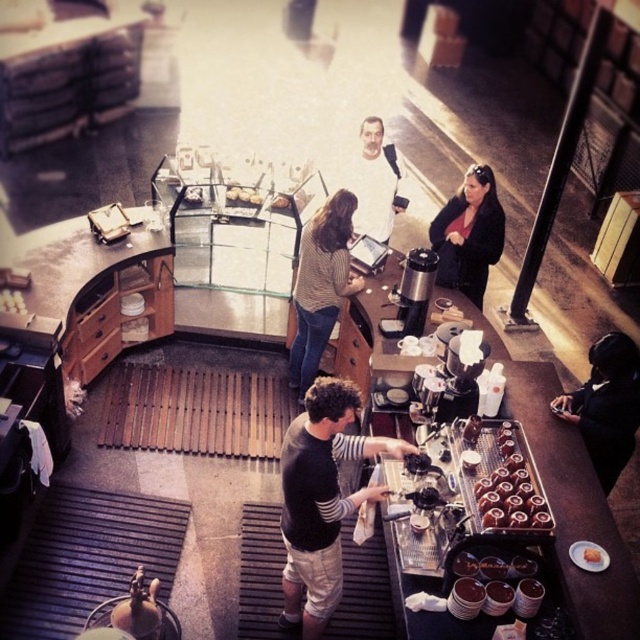
You are a customer in a coffee shop and want to place your order. You see two points marked on the floor, one at point (x=300, y=372) and another at point (x=230, y=195). Which point is closer to the counter where the barista is working?

Point (x=300, y=372) is in front of point (x=230, y=195), so it is closer to the counter where the barista is working.

From the picture: You are a customer in the coffee shop and want to grab both the chocolate frosted donuts at center and the golden brown pastry at center. Can you reach both items at the same time if your arms can extend 25 inches apart?

The chocolate frosted donuts at center and golden brown pastry at center are 24.95 inches apart from each other, so yes, you can reach both items at the same time since your arms can extend 25 inches which is slightly longer than the distance between them.

Looking at this image, you are a customer in the coffee shop and you see two jackets hanging on the wall behind the counter. The jackets are labeled as the black matte jacket at lower right and the matte black jacket at upper right. Which jacket is closer to the floor?

The black matte jacket at lower right is closer to the floor because it is positioned lower than the matte black jacket at upper right.